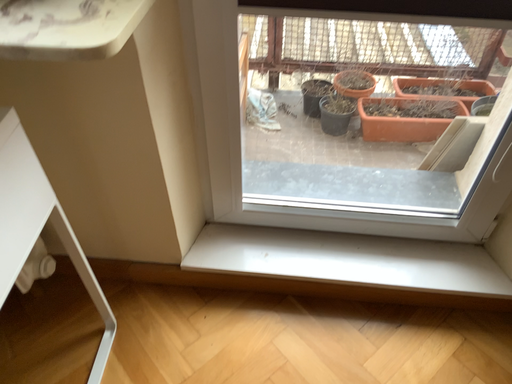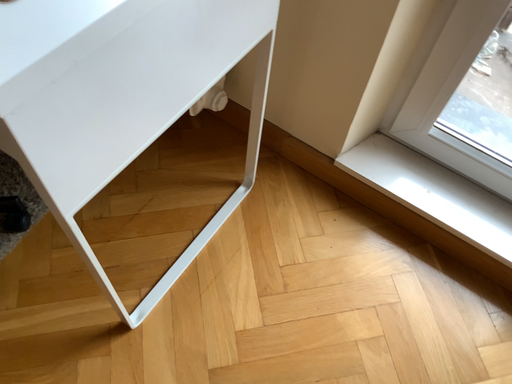
Question: How did the camera likely rotate when shooting the video?

Choices:
 (A) rotated right
 (B) rotated left

Answer: (B)